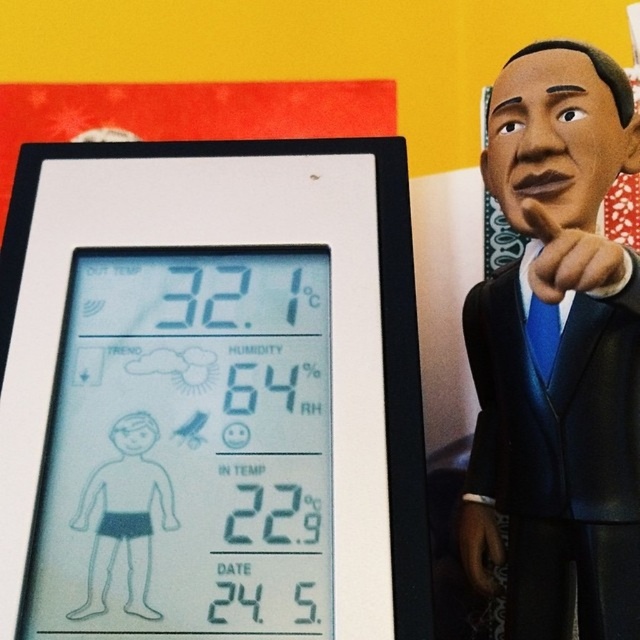
Consider the image. You are holding a camera and want to take a clear photo of both the transparent plastic thermometer at center and the white matte figure at center. Which object should you focus on first to ensure both are in focus?

You should focus on the white matte figure at center first because it is farther away from the viewer than the transparent plastic thermometer at center. By focusing on the farther object, the closer object will also be in focus due to the depth of field.

You are standing in front of the digital thermometer and hygrometer. There are two points marked on the screen at coordinates point (243, 324) and point (593, 602). Which point is closer to you?

Point (243, 324) is further to the viewer than point (593, 602). Therefore, point (243, 324) is closer to you.